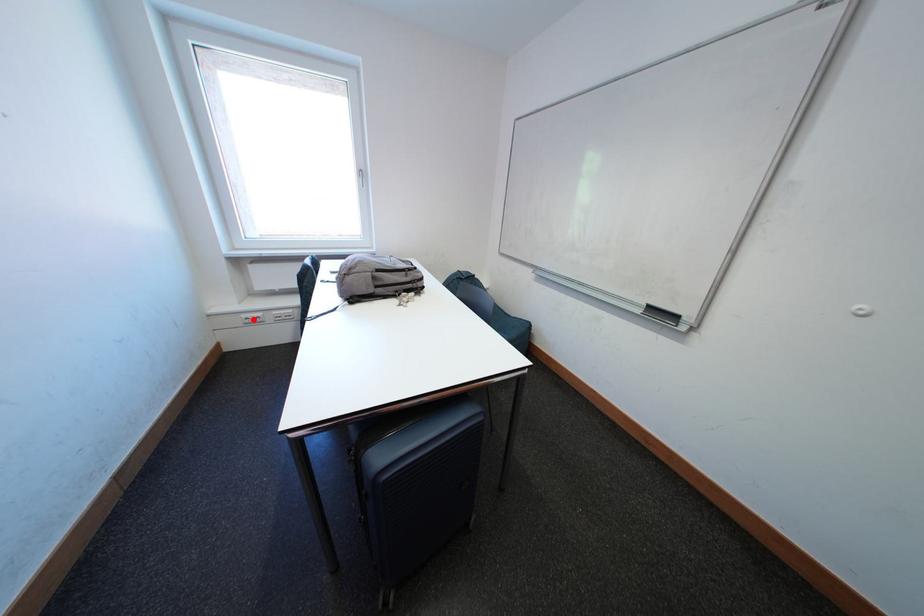
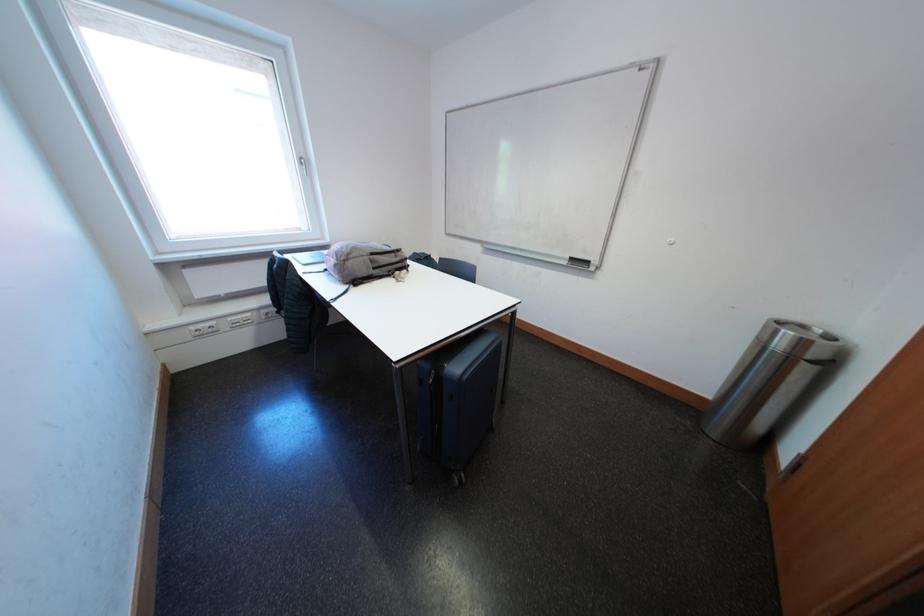
Where in the second image is the point corresponding to the highlighted location from the first image?

(202, 331)